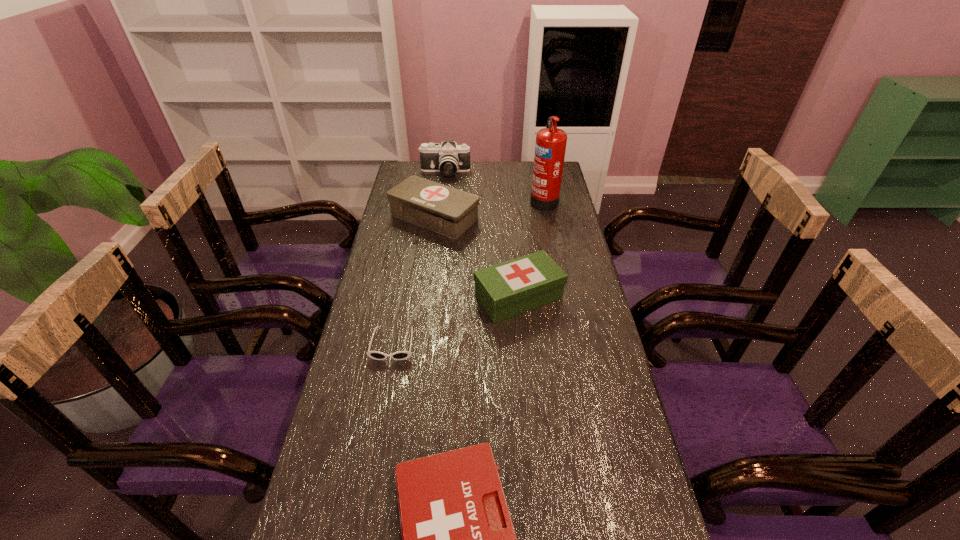
Where is `the first-aid kit that is at the right edge`? The width and height of the screenshot is (960, 540). the first-aid kit that is at the right edge is located at coordinates (507, 289).

You are a GUI agent. You are given a task and a screenshot of the screen. Output one action in this format:
    pyautogui.click(x=<x>, y=<y>)
    Task: Click on the object situated at the far left corner
    
    Given the screenshot: What is the action you would take?
    pyautogui.click(x=448, y=158)

In order to click on object that is at the far right corner in this screenshot , I will do `click(550, 146)`.

In the image, there is a desktop. Where is `free space at the far edge`? Image resolution: width=960 pixels, height=540 pixels. free space at the far edge is located at coordinates (521, 184).

In the image, there is a desktop. Where is `free space at the left edge`? free space at the left edge is located at coordinates (388, 390).

This screenshot has width=960, height=540. What are the coordinates of `free space at the right edge of the desktop` in the screenshot? It's located at (566, 193).

Locate an element on the screen. The image size is (960, 540). vacant point at the far left corner is located at coordinates (419, 170).

I want to click on empty space that is in between the farthest first-aid kit and the second nearest first-aid kit, so pyautogui.click(x=476, y=257).

Locate an element on the screen. The height and width of the screenshot is (540, 960). free space that is in between the shortest object and the tallest object is located at coordinates (468, 272).

The image size is (960, 540). What are the coordinates of `empty space that is in between the shortest object and the farthest first-aid kit` in the screenshot? It's located at (414, 281).